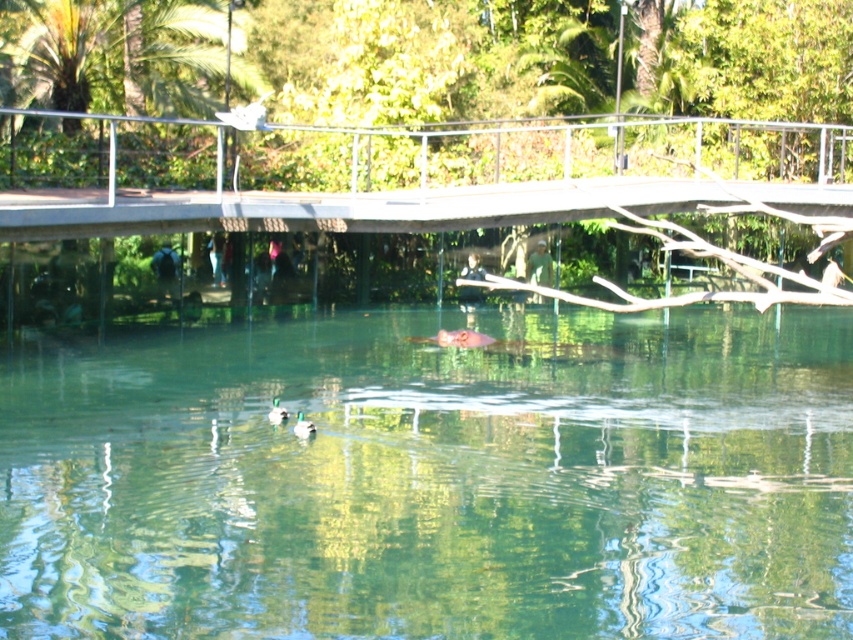
You are observing the ducks in the water. Which duck is closer to you, the green matte duck at lower center or the green matte duck at center?

The green matte duck at lower center is closer to you because it is positioned lower in the image, which typically indicates proximity in such scenes.

You are standing on the wooden bridge and looking down at the scene. Which object is closer to you, the clear water at center or the green matte duck at center?

The clear water at center is closer to the viewer than the green matte duck at center.